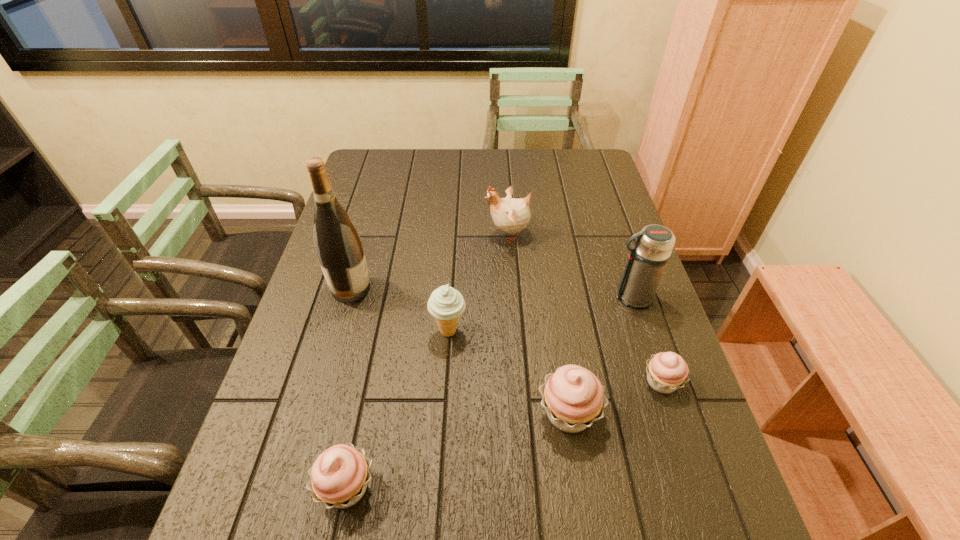
Identify the location of the second tallest cupcake. The width and height of the screenshot is (960, 540). (339, 476).

Locate an element on the screen. the sixth tallest object is located at coordinates (339, 476).

Where is `the tallest cupcake`? Image resolution: width=960 pixels, height=540 pixels. the tallest cupcake is located at coordinates (573, 397).

At what (x,y) coordinates should I click in order to perform the action: click on the shortest cupcake. Please return your answer as a coordinate pair (x, y). Image resolution: width=960 pixels, height=540 pixels. Looking at the image, I should click on (667, 371).

Identify the location of the shortest object. (667, 371).

Locate an element on the screen. icecream is located at coordinates (446, 304).

This screenshot has width=960, height=540. I want to click on the fourth farthest object, so click(446, 304).

The image size is (960, 540). I want to click on bird, so click(x=510, y=215).

Locate an element on the screen. wine bottle is located at coordinates (338, 246).

This screenshot has height=540, width=960. I want to click on thermos bottle, so click(x=647, y=260).